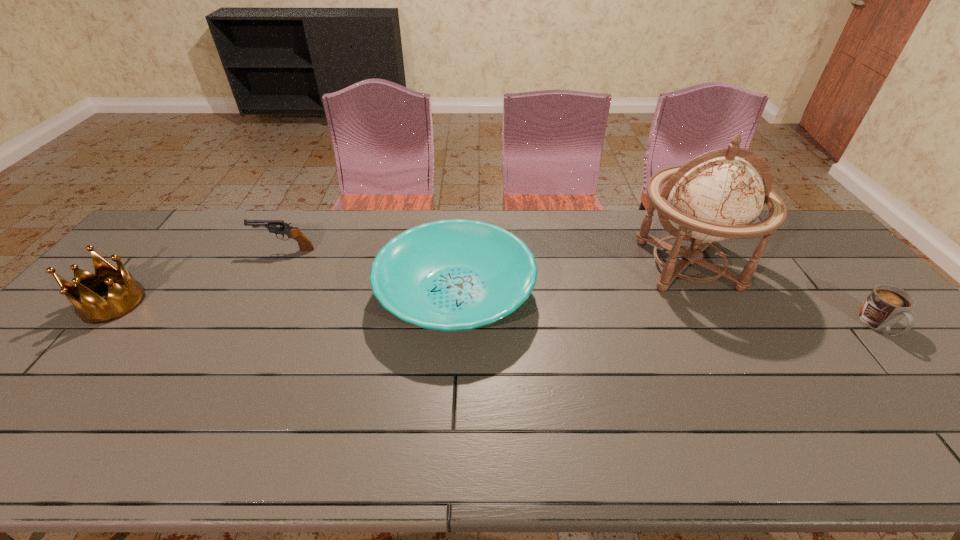
At what (x,y) coordinates should I click in order to perform the action: click on free point located along the barrel of the fourth object from right to left. Please return your answer as a coordinate pair (x, y). Image resolution: width=960 pixels, height=540 pixels. Looking at the image, I should click on (200, 250).

Where is `vacant point located 0.250m along the barrel of the fourth object from right to left`? The height and width of the screenshot is (540, 960). vacant point located 0.250m along the barrel of the fourth object from right to left is located at coordinates (178, 250).

Identify the location of vacant area situated 0.270m on the left of the third object from right to left. (282, 294).

Identify the location of free spot located on the side of the rightmost object with the handle. The width and height of the screenshot is (960, 540). tap(937, 392).

Identify the location of globe that is at the far edge. The width and height of the screenshot is (960, 540). (716, 196).

Where is `gun that is at the far edge`? The height and width of the screenshot is (540, 960). gun that is at the far edge is located at coordinates (274, 226).

At what (x,y) coordinates should I click in order to perform the action: click on dish at the far edge. Please return your answer as a coordinate pair (x, y). Looking at the image, I should click on (449, 275).

The image size is (960, 540). I want to click on object that is at the left edge, so click(x=89, y=306).

This screenshot has height=540, width=960. In order to click on object at the right edge in this screenshot , I will do `click(886, 305)`.

Image resolution: width=960 pixels, height=540 pixels. In order to click on free space at the far edge of the desktop in this screenshot , I will do `click(605, 226)`.